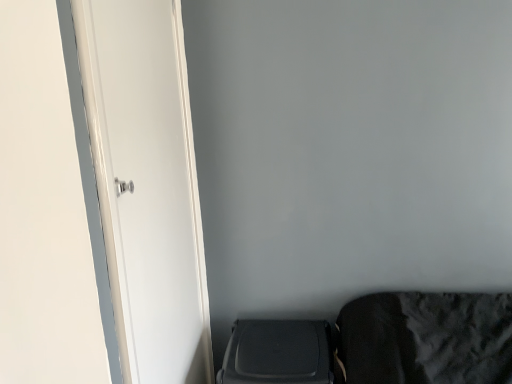
The height and width of the screenshot is (384, 512). Identify the location of black matte suitcase at lower right. (278, 353).

What do you see at coordinates (278, 353) in the screenshot?
I see `black matte suitcase at lower right` at bounding box center [278, 353].

This screenshot has height=384, width=512. What are the coordinates of `white glossy door at left` in the screenshot? It's located at (147, 185).

Describe the element at coordinates (147, 185) in the screenshot. The height and width of the screenshot is (384, 512). I see `white glossy door at left` at that location.

I want to click on black matte suitcase at lower right, so click(278, 353).

Between black matte suitcase at lower right and white glossy door at left, which one appears on the right side from the viewer's perspective?

black matte suitcase at lower right.

Is the depth of black matte suitcase at lower right less than that of white glossy door at left?

No, black matte suitcase at lower right is further to the viewer.

Between point (266, 323) and point (113, 285), which one is positioned in front?

The point (113, 285) is closer to the camera.

From the image's perspective, is black matte suitcase at lower right beneath white glossy door at left?

Yes, from the image's perspective, black matte suitcase at lower right is beneath white glossy door at left.

From a real-world perspective, is black matte suitcase at lower right located higher than white glossy door at left?

No, from a real-world perspective, black matte suitcase at lower right is not on top of white glossy door at left.

Considering the sizes of objects black matte suitcase at lower right and white glossy door at left in the image provided, who is thinner, black matte suitcase at lower right or white glossy door at left?

white glossy door at left is thinner.

Considering the sizes of black matte suitcase at lower right and white glossy door at left in the image, is black matte suitcase at lower right taller or shorter than white glossy door at left?

Considering their sizes, black matte suitcase at lower right has less height than white glossy door at left.

Can you confirm if black matte suitcase at lower right is smaller than white glossy door at left?

Actually, black matte suitcase at lower right might be larger than white glossy door at left.

Is black matte suitcase at lower right surrounding white glossy door at left?

No, white glossy door at left is not a part of black matte suitcase at lower right.

Would you consider black matte suitcase at lower right to be distant from white glossy door at left?

Actually, black matte suitcase at lower right and white glossy door at left are a little close together.

Consider the image. Is black matte suitcase at lower right aimed at white glossy door at left?

No, black matte suitcase at lower right does not turn towards white glossy door at left.

You are a GUI agent. You are given a task and a screenshot of the screen. Output one action in this format:
    pyautogui.click(x=<x>, y=<y>)
    Task: Click on the appliance below the white glossy door at left (from the image's perspective)
    This screenshot has height=384, width=512.
    Given the screenshot: What is the action you would take?
    pyautogui.click(x=278, y=353)

Considering the relative positions of white glossy door at left and black matte suitcase at lower right in the image provided, is white glossy door at left to the left or to the right of black matte suitcase at lower right?

From the image, it's evident that white glossy door at left is to the left of black matte suitcase at lower right.

Is white glossy door at left further to the viewer compared to black matte suitcase at lower right?

No, white glossy door at left is closer to the viewer.

Which point is more forward, [127,58] or [322,369]?

Point [127,58]

From the image's perspective, is white glossy door at left above or below black matte suitcase at lower right?

white glossy door at left is situated higher than black matte suitcase at lower right in the image.

From a real-world perspective, is white glossy door at left positioned under black matte suitcase at lower right based on gravity?

Incorrect, from a real-world perspective, white glossy door at left is higher than black matte suitcase at lower right.

Consider the image. Can you confirm if white glossy door at left is thinner than black matte suitcase at lower right?

Yes, white glossy door at left is thinner than black matte suitcase at lower right.

From the picture: Does white glossy door at left have a greater height compared to black matte suitcase at lower right?

Indeed, white glossy door at left has a greater height compared to black matte suitcase at lower right.

Considering the sizes of objects white glossy door at left and black matte suitcase at lower right in the image provided, who is smaller, white glossy door at left or black matte suitcase at lower right?

Smaller between the two is white glossy door at left.

Do you think white glossy door at left is within black matte suitcase at lower right, or outside of it?

white glossy door at left is located beyond the bounds of black matte suitcase at lower right.

Based on the photo, is white glossy door at left placed right next to black matte suitcase at lower right?

No, white glossy door at left is not making contact with black matte suitcase at lower right.

Is black matte suitcase at lower right at the back of white glossy door at left?

No, black matte suitcase at lower right is not at the back of white glossy door at left.

Measure the distance from white glossy door at left to black matte suitcase at lower right.

white glossy door at left and black matte suitcase at lower right are 19.65 inches apart.

I want to click on appliance beneath the white glossy door at left (from a real-world perspective), so click(278, 353).

Locate an element on the screen. This screenshot has width=512, height=384. door in front of the black matte suitcase at lower right is located at coordinates (147, 185).

Locate an element on the screen. This screenshot has height=384, width=512. door located on the left of black matte suitcase at lower right is located at coordinates (147, 185).